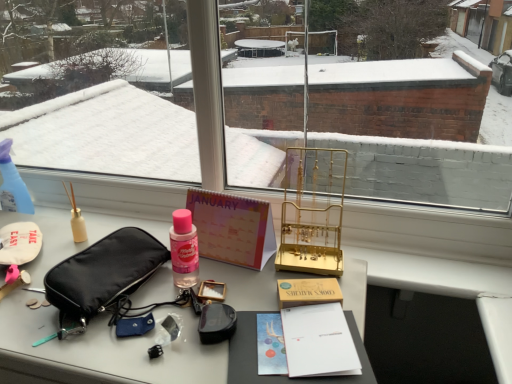
The width and height of the screenshot is (512, 384). I want to click on matte black pouch at left, so click(103, 349).

What do you see at coordinates (312, 211) in the screenshot? I see `gold metallic jewelry stand at center` at bounding box center [312, 211].

Where is `black fabric pouch at left`? The width and height of the screenshot is (512, 384). black fabric pouch at left is located at coordinates (102, 276).

Which object is positioned more to the left, transparent plastic spray bottle at left or black fabric pouch at left?

transparent plastic spray bottle at left is more to the left.

From a real-world perspective, is transparent plastic spray bottle at left positioned over black fabric pouch at left based on gravity?

Yes, from a real-world perspective, transparent plastic spray bottle at left is above black fabric pouch at left.

Is transparent plastic spray bottle at left positioned behind black fabric pouch at left?

Yes, it is.

Is pastel paper calendar at center bigger than matte black pouch at left?

No.

Locate an element on the screen. The image size is (512, 384). desk in front of the pastel paper calendar at center is located at coordinates (103, 349).

Does pastel paper calendar at center have a lesser width compared to matte black pouch at left?

Yes, pastel paper calendar at center is thinner than matte black pouch at left.

Is matte black pouch at left directly adjacent to gold metallic jewelry stand at center?

matte black pouch at left is not next to gold metallic jewelry stand at center, and they're not touching.

Does matte black pouch at left have a lesser width compared to gold metallic jewelry stand at center?

No.

In the image, there is a gold metallic jewelry stand at center. At what (x,y) coordinates should I click in order to perform the action: click on desk below it (from a real-world perspective). Please return your answer as a coordinate pair (x, y). The image size is (512, 384). Looking at the image, I should click on (103, 349).

Considering the sizes of objects black fabric pouch at left and transparent plastic spray bottle at left in the image provided, who is wider, black fabric pouch at left or transparent plastic spray bottle at left?

With larger width is black fabric pouch at left.

From the image's perspective, is black fabric pouch at left above or below transparent plastic spray bottle at left?

Clearly, from the image's perspective, black fabric pouch at left is below transparent plastic spray bottle at left.

From a real-world perspective, is black fabric pouch at left physically below transparent plastic spray bottle at left?

Yes, from a real-world perspective, black fabric pouch at left is beneath transparent plastic spray bottle at left.

Between black fabric pouch at left and transparent plastic spray bottle at left, which one has less height?

black fabric pouch at left is shorter.

Does transparent plastic spray bottle at left have a greater width compared to pastel paper calendar at center?

Indeed, transparent plastic spray bottle at left has a greater width compared to pastel paper calendar at center.

Considering the positions of point (22, 202) and point (230, 204), is point (22, 202) closer or farther from the camera than point (230, 204)?

Point (22, 202).

Considering the sizes of objects transparent plastic spray bottle at left and pastel paper calendar at center in the image provided, who is taller, transparent plastic spray bottle at left or pastel paper calendar at center?

Standing taller between the two is pastel paper calendar at center.

Which object is closer to the camera taking this photo, transparent plastic spray bottle at left or pastel paper calendar at center?

pastel paper calendar at center is in front.

Looking at this image, how different are the orientations of matte black pouch at left and transparent plastic spray bottle at left in degrees?

The angle between the facing direction of matte black pouch at left and the facing direction of transparent plastic spray bottle at left is 1.65 degrees.

From the image's perspective, is matte black pouch at left above or below transparent plastic spray bottle at left?

Clearly, from the image's perspective, matte black pouch at left is below transparent plastic spray bottle at left.

Is matte black pouch at left far from transparent plastic spray bottle at left?

No, there isn't a large distance between matte black pouch at left and transparent plastic spray bottle at left.

Does point (354, 265) lie in front of point (12, 203)?

Yes, it is in front of point (12, 203).

Is black fabric pouch at left wider than pastel paper calendar at center?

Yes, black fabric pouch at left is wider than pastel paper calendar at center.

From a real-world perspective, is black fabric pouch at left on top of pastel paper calendar at center?

No.

Find the location of a particular element. This screenshot has height=384, width=512. handbag lying in front of the pastel paper calendar at center is located at coordinates (102, 276).

Is black fabric pouch at left not near pastel paper calendar at center?

Actually, black fabric pouch at left and pastel paper calendar at center are a little close together.

Locate an element on the screen. Image resolution: width=512 pixels, height=384 pixels. bottle above the black fabric pouch at left (from a real-world perspective) is located at coordinates (12, 184).

You are a GUI agent. You are given a task and a screenshot of the screen. Output one action in this format:
    pyautogui.click(x=<x>, y=<y>)
    Task: Click on the book on the right of matte black pouch at left
    The height and width of the screenshot is (384, 512).
    Given the screenshot: What is the action you would take?
    pyautogui.click(x=232, y=228)

From the image, which object appears to be farther from pastel paper calendar at center, black fabric pouch at left or matte black pouch at left?

matte black pouch at left is further to pastel paper calendar at center.

Which object lies nearer to the anchor point gold metallic jewelry stand at center, black fabric pouch at left or matte black pouch at left?

matte black pouch at left.

Based on their spatial positions, is pastel paper calendar at center or black fabric pouch at left closer to gold metallic jewelry stand at center?

pastel paper calendar at center lies closer to gold metallic jewelry stand at center than the other object.

When comparing their distances from pastel paper calendar at center, does black fabric pouch at left or transparent plastic spray bottle at left seem further?

The object further to pastel paper calendar at center is transparent plastic spray bottle at left.

From the image, which object appears to be nearer to gold metallic jewelry stand at center, transparent plastic spray bottle at left or pastel paper calendar at center?

The object closer to gold metallic jewelry stand at center is pastel paper calendar at center.

Based on their spatial positions, is gold metallic jewelry stand at center or transparent plastic spray bottle at left further from pastel paper calendar at center?

transparent plastic spray bottle at left lies further to pastel paper calendar at center than the other object.

Estimate the real-world distances between objects in this image. Which object is closer to gold metallic jewelry stand at center, black fabric pouch at left or transparent plastic spray bottle at left?

The object closer to gold metallic jewelry stand at center is black fabric pouch at left.

Estimate the real-world distances between objects in this image. Which object is closer to pastel paper calendar at center, gold metallic jewelry stand at center or matte black pouch at left?

Based on the image, matte black pouch at left appears to be nearer to pastel paper calendar at center.

Locate an element on the screen. handbag that lies between pastel paper calendar at center and matte black pouch at left from top to bottom is located at coordinates (102, 276).

Identify the location of book between matte black pouch at left and transparent plastic spray bottle at left from front to back. click(x=232, y=228).

Find the location of a particular element. The width and height of the screenshot is (512, 384). handbag situated between transparent plastic spray bottle at left and gold metallic jewelry stand at center from left to right is located at coordinates (102, 276).

Find the location of `handbag situated between transparent plastic spray bottle at left and pastel paper calendar at center from left to right`. handbag situated between transparent plastic spray bottle at left and pastel paper calendar at center from left to right is located at coordinates (102, 276).